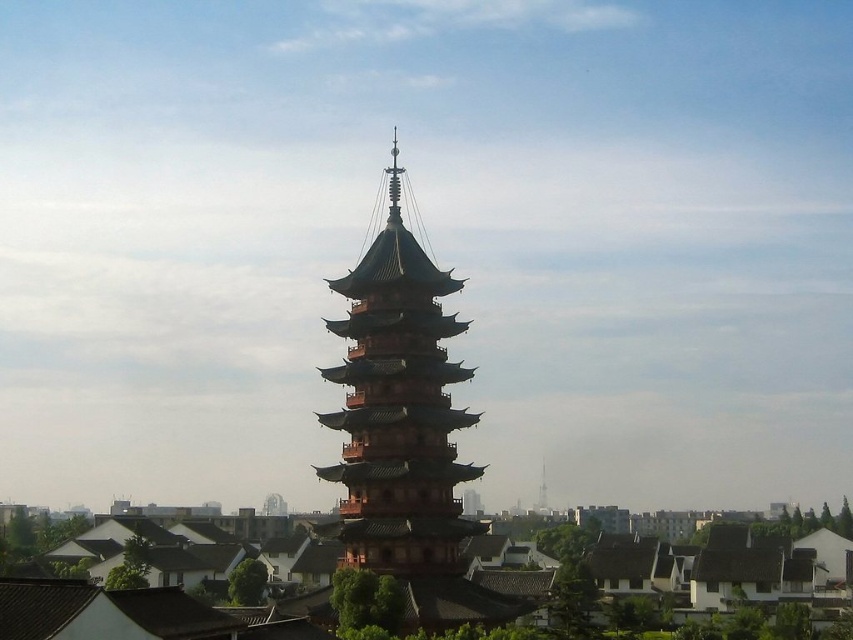
Question: Can you confirm if brown wooden pagoda at center is thinner than smooth white spire at center?

Choices:
 (A) no
 (B) yes

Answer: (A)

Question: Which point is farther to the camera?

Choices:
 (A) (544, 497)
 (B) (468, 321)

Answer: (A)

Question: Considering the relative positions of brown wooden pagoda at center and smooth white spire at center in the image provided, where is brown wooden pagoda at center located with respect to smooth white spire at center?

Choices:
 (A) below
 (B) above

Answer: (B)

Question: Which object appears closest to the camera in this image?

Choices:
 (A) brown wooden pagoda at center
 (B) smooth white spire at center

Answer: (A)

Question: Observing the image, what is the correct spatial positioning of brown wooden pagoda at center in reference to smooth white spire at center?

Choices:
 (A) left
 (B) right

Answer: (A)